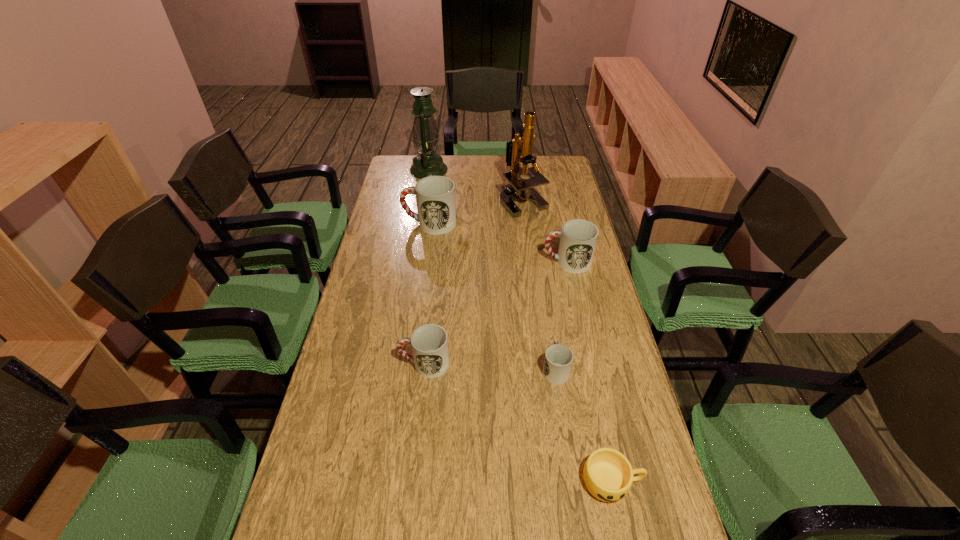
Choose which object is the fifth nearest neighbor to the gold microscope. Please provide its 2D coordinates. Your answer should be formatted as a tuple, i.e. [(x, y)], where the tuple contains the x and y coordinates of a point satisfying the conditions above.

[(429, 342)]

You are a GUI agent. You are given a task and a screenshot of the screen. Output one action in this format:
    pyautogui.click(x=<x>, y=<y>)
    Task: Click on the second closest cup relative to the second shortest cup
    Image resolution: width=960 pixels, height=540 pixels.
    Given the screenshot: What is the action you would take?
    pyautogui.click(x=429, y=342)

Find the location of `the fourth closest cup relative to the third smallest red cup`. the fourth closest cup relative to the third smallest red cup is located at coordinates (608, 475).

Where is `red cup that is the third closest to the sixth tallest object`? The image size is (960, 540). red cup that is the third closest to the sixth tallest object is located at coordinates (435, 195).

Locate which red cup is the second closest to the third tallest cup. Please provide its 2D coordinates. Your answer should be formatted as a tuple, i.e. [(x, y)], where the tuple contains the x and y coordinates of a point satisfying the conditions above.

[(578, 238)]

The width and height of the screenshot is (960, 540). I want to click on free point that satisfies the following two spatial constraints: 1. on the side of the sixth tallest object where the handle is located; 2. on the side of the fourth shortest cup where the handle is located, so click(540, 262).